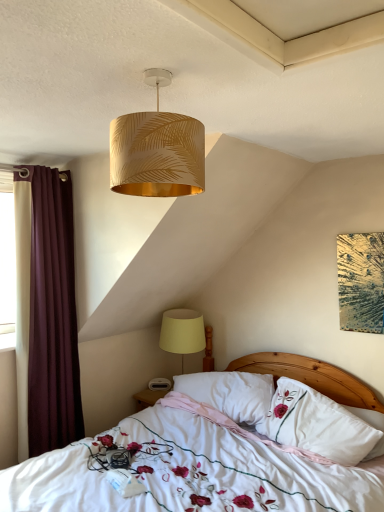
The width and height of the screenshot is (384, 512). What do you see at coordinates (192, 473) in the screenshot?
I see `white floral fabric bed at center` at bounding box center [192, 473].

The image size is (384, 512). What are the coordinates of `yellow fabric lampshade at lower center, arranged as the second lamp when viewed from the front` in the screenshot? It's located at (182, 332).

What do you see at coordinates (157, 150) in the screenshot? This screenshot has height=512, width=384. I see `gold leaf-patterned lampshade at upper center, the first lamp positioned from the top` at bounding box center [157, 150].

How much space does gold leaf-patterned lampshade at upper center, which is the first lamp in front-to-back order, occupy vertically?

It is 36.86 centimeters.

Find the location of `maroon fabric curtain at left`. maroon fabric curtain at left is located at coordinates (47, 308).

Which of these two, white floral fabric bed at center or gold leaf-patterned lampshade at upper center, positioned as the second lamp in bottom-to-top order, is bigger?

white floral fabric bed at center is bigger.

Between white floral fabric bed at center and gold leaf-patterned lampshade at upper center, which is the first lamp in front-to-back order, which one has more height?

Standing taller between the two is white floral fabric bed at center.

Which is further, [201,461] or [133,172]?

The point [201,461] is farther.

Locate an element on the screen. bed below the gold leaf-patterned lampshade at upper center, acting as the second lamp starting from the back (from the image's perspective) is located at coordinates (192, 473).

Is white floral fabric bed at center further to camera compared to yellow fabric lampshade at lower center, the first lamp in the bottom-to-top sequence?

No, it is not.

Could yellow fabric lampshade at lower center, arranged as the second lamp when viewed from the front, be considered to be inside white floral fabric bed at center?

That's correct, yellow fabric lampshade at lower center, arranged as the second lamp when viewed from the front, is inside white floral fabric bed at center.

Can you confirm if white floral fabric bed at center is shorter than yellow fabric lampshade at lower center, the first lamp in the bottom-to-top sequence?

In fact, white floral fabric bed at center may be taller than yellow fabric lampshade at lower center, the first lamp in the bottom-to-top sequence.

There is a white floral fabric bed at center. Where is `the 1st lamp above it (from the image's perspective)`? the 1st lamp above it (from the image's perspective) is located at coordinates (182, 332).

Considering the sizes of objects yellow fabric lampshade at lower center, the first lamp in the bottom-to-top sequence, and maroon fabric curtain at left in the image provided, who is taller, yellow fabric lampshade at lower center, the first lamp in the bottom-to-top sequence, or maroon fabric curtain at left?

maroon fabric curtain at left is taller.

From a real-world perspective, between yellow fabric lampshade at lower center, the first lamp in the bottom-to-top sequence, and maroon fabric curtain at left, who is vertically higher?

From a 3D spatial view, maroon fabric curtain at left is above.

Could you measure the distance between yellow fabric lampshade at lower center, the first lamp in the bottom-to-top sequence, and maroon fabric curtain at left?

35.78 inches.

Consider the image. How different are the orientations of yellow fabric lampshade at lower center, the first lamp in the bottom-to-top sequence, and maroon fabric curtain at left in degrees?

yellow fabric lampshade at lower center, the first lamp in the bottom-to-top sequence, and maroon fabric curtain at left are facing 88.4 degrees away from each other.

Does gold leaf-patterned lampshade at upper center, acting as the second lamp starting from the back, appear on the left side of yellow fabric lampshade at lower center, which is the 1th lamp in back-to-front order?

Yes, gold leaf-patterned lampshade at upper center, acting as the second lamp starting from the back, is to the left of yellow fabric lampshade at lower center, which is the 1th lamp in back-to-front order.

Which object is closer to the camera, gold leaf-patterned lampshade at upper center, acting as the second lamp starting from the back, or yellow fabric lampshade at lower center, which is the 1th lamp in back-to-front order?

gold leaf-patterned lampshade at upper center, acting as the second lamp starting from the back, is more forward.

From a real-world perspective, is gold leaf-patterned lampshade at upper center, acting as the second lamp starting from the back, physically below yellow fabric lampshade at lower center, which is the 1th lamp in back-to-front order?

No.

Is gold leaf-patterned lampshade at upper center, the first lamp positioned from the top, far away from yellow fabric lampshade at lower center, which is the 1th lamp in back-to-front order?

Indeed, gold leaf-patterned lampshade at upper center, the first lamp positioned from the top, is not near yellow fabric lampshade at lower center, which is the 1th lamp in back-to-front order.

Is gold leaf-patterned lampshade at upper center, which is the first lamp in front-to-back order, at the left side of white floral fabric bed at center?

Yes.

The image size is (384, 512). There is a white floral fabric bed at center. Find the location of `the 2nd lamp above it (from a real-world perspective)`. the 2nd lamp above it (from a real-world perspective) is located at coordinates [x=157, y=150].

Measure the distance from gold leaf-patterned lampshade at upper center, which is the first lamp in front-to-back order, to white floral fabric bed at center.

1.48 meters.

Is white floral fabric bed at center at the back of maroon fabric curtain at left?

No, white floral fabric bed at center is not at the back of maroon fabric curtain at left.

From the image's perspective, is maroon fabric curtain at left on white floral fabric bed at center?

Indeed, from the image's perspective, maroon fabric curtain at left is shown above white floral fabric bed at center.

Considering the relative sizes of maroon fabric curtain at left and white floral fabric bed at center in the image provided, is maroon fabric curtain at left taller than white floral fabric bed at center?

Yes, maroon fabric curtain at left is taller than white floral fabric bed at center.

Considering the positions of objects maroon fabric curtain at left and white floral fabric bed at center in the image provided, who is more to the left, maroon fabric curtain at left or white floral fabric bed at center?

maroon fabric curtain at left is more to the left.

Is white soft pillow at center, acting as the first pillow starting from the right, touching gold leaf-patterned lampshade at upper center, acting as the second lamp starting from the back?

No, white soft pillow at center, acting as the first pillow starting from the right, is not beside gold leaf-patterned lampshade at upper center, acting as the second lamp starting from the back.

From the image's perspective, is white soft pillow at center, placed as the 2th pillow when sorted from left to right, located above gold leaf-patterned lampshade at upper center, the first lamp positioned from the top?

No.

Could you measure the distance between white soft pillow at center, acting as the first pillow starting from the right, and gold leaf-patterned lampshade at upper center, which is the first lamp in front-to-back order?

The distance of white soft pillow at center, acting as the first pillow starting from the right, from gold leaf-patterned lampshade at upper center, which is the first lamp in front-to-back order, is 5.53 feet.

Is white soft pillow at center, placed as the 2th pillow when sorted from left to right, closer to the viewer compared to gold leaf-patterned lampshade at upper center, acting as the second lamp starting from the back?

No, it is not.

In order to click on the 2nd lamp above the white floral fabric bed at center (from the image's perspective) in this screenshot , I will do `click(157, 150)`.

From the white floral fabric bed at center, count 2nd lamps backward and point to it. Please provide its 2D coordinates.

[(182, 332)]

From the image, which object appears to be nearer to maroon fabric curtain at left, yellow fabric lampshade at lower center, which is the 1th lamp in back-to-front order, or gold leaf-patterned lampshade at upper center, which is the first lamp in front-to-back order?

Among the two, yellow fabric lampshade at lower center, which is the 1th lamp in back-to-front order, is located nearer to maroon fabric curtain at left.

From the image, which object appears to be nearer to maroon fabric curtain at left, gold leaf-patterned lampshade at upper center, the first lamp positioned from the top, or white soft pillow at center, acting as the first pillow starting from the right?

gold leaf-patterned lampshade at upper center, the first lamp positioned from the top, is positioned closer to the anchor maroon fabric curtain at left.

From the image, which object appears to be nearer to gold leaf-patterned lampshade at upper center, acting as the second lamp starting from the back, white floral fabric bed at center or maroon fabric curtain at left?

maroon fabric curtain at left is positioned closer to the anchor gold leaf-patterned lampshade at upper center, acting as the second lamp starting from the back.

Based on their spatial positions, is yellow fabric lampshade at lower center, the first lamp in the bottom-to-top sequence, or white soft pillow at center, placed as the 2th pillow when sorted from left to right, further from maroon fabric curtain at left?

Based on the image, white soft pillow at center, placed as the 2th pillow when sorted from left to right, appears to be further to maroon fabric curtain at left.

Considering their positions, is white soft pillow at center, the first pillow positioned from the left, positioned closer to gold leaf-patterned lampshade at upper center, the first lamp positioned from the top, than white soft pillow at center, placed as the 2th pillow when sorted from left to right?

white soft pillow at center, placed as the 2th pillow when sorted from left to right.

Which object lies further to the anchor point white soft pillow at center, positioned as the 2th pillow in right-to-left order, yellow fabric lampshade at lower center, arranged as the second lamp when viewed from the front, or white soft pillow at center, placed as the 2th pillow when sorted from left to right?

yellow fabric lampshade at lower center, arranged as the second lamp when viewed from the front, is positioned further to the anchor white soft pillow at center, positioned as the 2th pillow in right-to-left order.

Considering their positions, is white floral fabric bed at center positioned further to white soft pillow at center, placed as the 2th pillow when sorted from left to right, than white soft pillow at center, positioned as the 2th pillow in right-to-left order?

Based on the image, white floral fabric bed at center appears to be further to white soft pillow at center, placed as the 2th pillow when sorted from left to right.

Based on their spatial positions, is yellow fabric lampshade at lower center, the second lamp in the top-to-bottom sequence, or maroon fabric curtain at left further from white soft pillow at center, acting as the first pillow starting from the right?

maroon fabric curtain at left is positioned further to the anchor white soft pillow at center, acting as the first pillow starting from the right.

Locate an element on the screen. The width and height of the screenshot is (384, 512). curtain positioned between gold leaf-patterned lampshade at upper center, the first lamp positioned from the top, and yellow fabric lampshade at lower center, the second lamp in the top-to-bottom sequence, from near to far is located at coordinates (47, 308).

The height and width of the screenshot is (512, 384). Find the location of `curtain between white floral fabric bed at center and white soft pillow at center, positioned as the 2th pillow in right-to-left order, in the front-back direction`. curtain between white floral fabric bed at center and white soft pillow at center, positioned as the 2th pillow in right-to-left order, in the front-back direction is located at coordinates (47, 308).

This screenshot has width=384, height=512. What are the coordinates of `lamp positioned between white floral fabric bed at center and white soft pillow at center, positioned as the 2th pillow in right-to-left order, from near to far` in the screenshot? It's located at (157, 150).

Where is `pillow between white floral fabric bed at center and maroon fabric curtain at left from front to back`? The image size is (384, 512). pillow between white floral fabric bed at center and maroon fabric curtain at left from front to back is located at coordinates (320, 424).